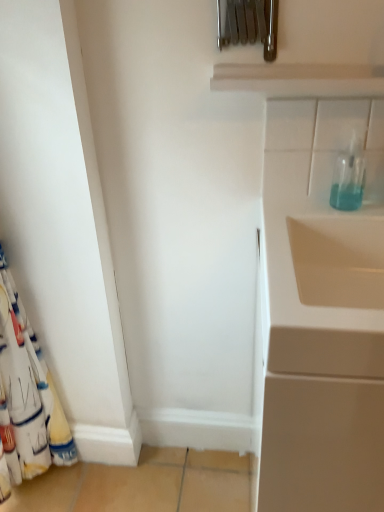
What do you see at coordinates (28, 393) in the screenshot?
I see `white fabric curtain at left` at bounding box center [28, 393].

Locate an element on the screen. The width and height of the screenshot is (384, 512). white fabric curtain at left is located at coordinates (28, 393).

Describe the element at coordinates (349, 176) in the screenshot. I see `transparent glass bottle at upper right` at that location.

The width and height of the screenshot is (384, 512). In order to click on white fabric curtain at left in this screenshot , I will do `click(28, 393)`.

Does white fabric curtain at left have a lesser height compared to transparent glass bottle at upper right?

Incorrect, the height of white fabric curtain at left does not fall short of that of transparent glass bottle at upper right.

Is white fabric curtain at left not near transparent glass bottle at upper right?

No, white fabric curtain at left is in close proximity to transparent glass bottle at upper right.

From the image's perspective, which object appears higher, white fabric curtain at left or transparent glass bottle at upper right?

transparent glass bottle at upper right is shown above in the image.

I want to click on bottle lying above the white fabric curtain at left (from the image's perspective), so click(x=349, y=176).

From a real-world perspective, is transparent glass bottle at upper right located higher than white fabric curtain at left?

Yes.

Choose the correct answer: Is transparent glass bottle at upper right inside white fabric curtain at left or outside it?

The correct answer is: outside.

Are white glossy cabinet at right and transparent glass bottle at upper right making contact?

white glossy cabinet at right and transparent glass bottle at upper right are clearly separated.

Considering the sizes of objects white glossy cabinet at right and transparent glass bottle at upper right in the image provided, who is shorter, white glossy cabinet at right or transparent glass bottle at upper right?

transparent glass bottle at upper right is shorter.

Is white glossy cabinet at right in front of or behind transparent glass bottle at upper right in the image?

In the image, white glossy cabinet at right appears in front of transparent glass bottle at upper right.

Is white glossy cabinet at right bigger or smaller than white fabric curtain at left?

Considering their sizes, white glossy cabinet at right takes up more space than white fabric curtain at left.

Between point (332, 464) and point (10, 415), which one is positioned behind?

The point (10, 415) is behind.

Considering the positions of objects white glossy cabinet at right and white fabric curtain at left in the image provided, who is more to the left, white glossy cabinet at right or white fabric curtain at left?

From the viewer's perspective, white fabric curtain at left appears more on the left side.

Is white glossy cabinet at right not within white fabric curtain at left?

Yes, white glossy cabinet at right is outside of white fabric curtain at left.

How different are the orientations of transparent glass bottle at upper right and white glossy cabinet at right in degrees?

The angular difference between transparent glass bottle at upper right and white glossy cabinet at right is 0.0293 degrees.

Is transparent glass bottle at upper right facing towards white glossy cabinet at right?

No.

Consider the image. Between transparent glass bottle at upper right and white glossy cabinet at right, which one appears on the right side from the viewer's perspective?

white glossy cabinet at right.

Image resolution: width=384 pixels, height=512 pixels. I want to click on curtain on the left of white glossy cabinet at right, so click(x=28, y=393).

Would you say white fabric curtain at left is to the left or to the right of white glossy cabinet at right in the picture?

white fabric curtain at left is to the left of white glossy cabinet at right.

Is white fabric curtain at left looking in the opposite direction of white glossy cabinet at right?

white fabric curtain at left does not have its back to white glossy cabinet at right.

Is white fabric curtain at left taller or shorter than white glossy cabinet at right?

Clearly, white fabric curtain at left is taller compared to white glossy cabinet at right.

Locate an element on the screen. This screenshot has height=512, width=384. curtain on the left of transparent glass bottle at upper right is located at coordinates (28, 393).

Locate an element on the screen. This screenshot has width=384, height=512. bottle lying on the right of white fabric curtain at left is located at coordinates (349, 176).

Estimate the real-world distances between objects in this image. Which object is closer to white fabric curtain at left, transparent glass bottle at upper right or white glossy cabinet at right?

white glossy cabinet at right lies closer to white fabric curtain at left than the other object.

Looking at this image, estimate the real-world distances between objects in this image. Which object is closer to transparent glass bottle at upper right, white glossy cabinet at right or white fabric curtain at left?

white glossy cabinet at right.

Which object lies nearer to the anchor point white glossy cabinet at right, white fabric curtain at left or transparent glass bottle at upper right?

transparent glass bottle at upper right is positioned closer to the anchor white glossy cabinet at right.

Which object lies further to the anchor point transparent glass bottle at upper right, white fabric curtain at left or white glossy cabinet at right?

white fabric curtain at left.

Looking at the image, which one is located closer to white glossy cabinet at right, transparent glass bottle at upper right or white fabric curtain at left?

transparent glass bottle at upper right lies closer to white glossy cabinet at right than the other object.

When comparing their distances from white fabric curtain at left, does white glossy cabinet at right or transparent glass bottle at upper right seem closer?

The object closer to white fabric curtain at left is white glossy cabinet at right.

Locate an element on the screen. bottle between white fabric curtain at left and white glossy cabinet at right is located at coordinates pos(349,176).